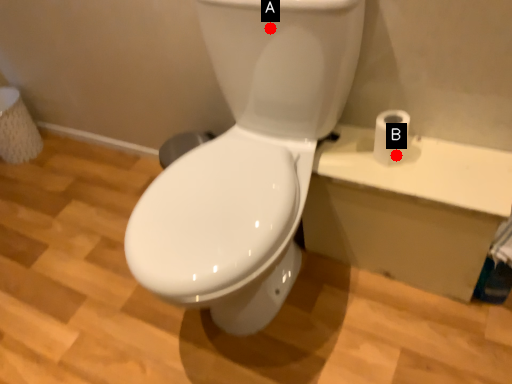
Question: Two points are circled on the image, labeled by A and B beside each circle. Which of the following is the closest to the observer?

Choices:
 (A) A is closer
 (B) B is closer

Answer: (A)